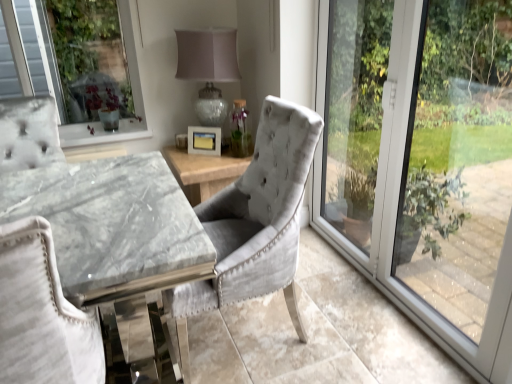
Identify the location of vacant area that is in front of transparent glass window at right. Image resolution: width=512 pixels, height=384 pixels. (375, 339).